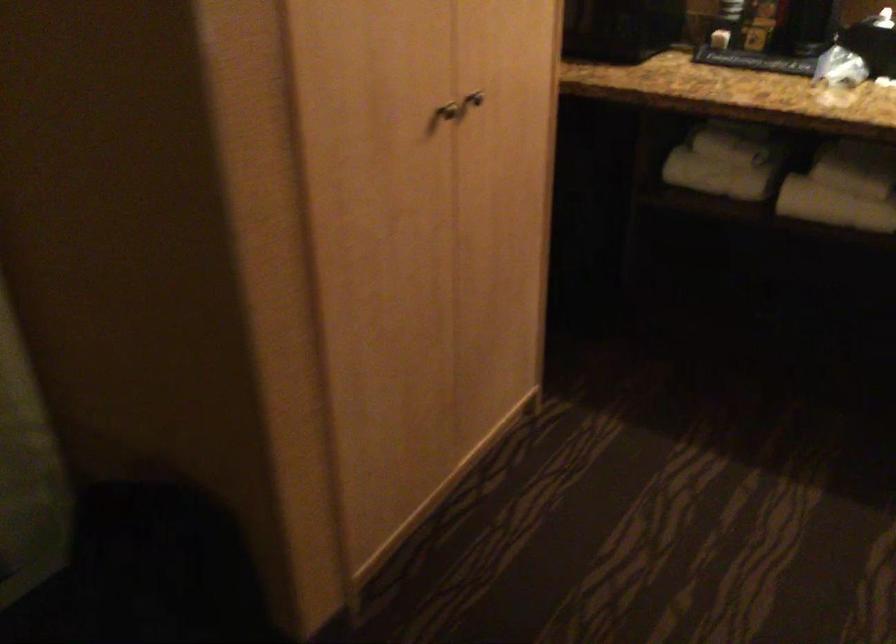
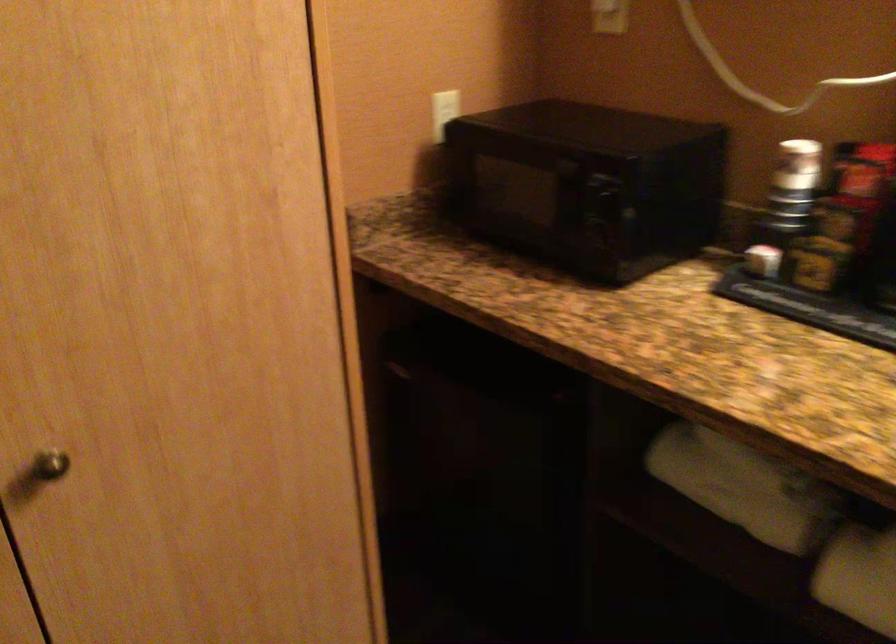
Find the pixel in the second image that matches point 807,198 in the first image.

(858, 576)